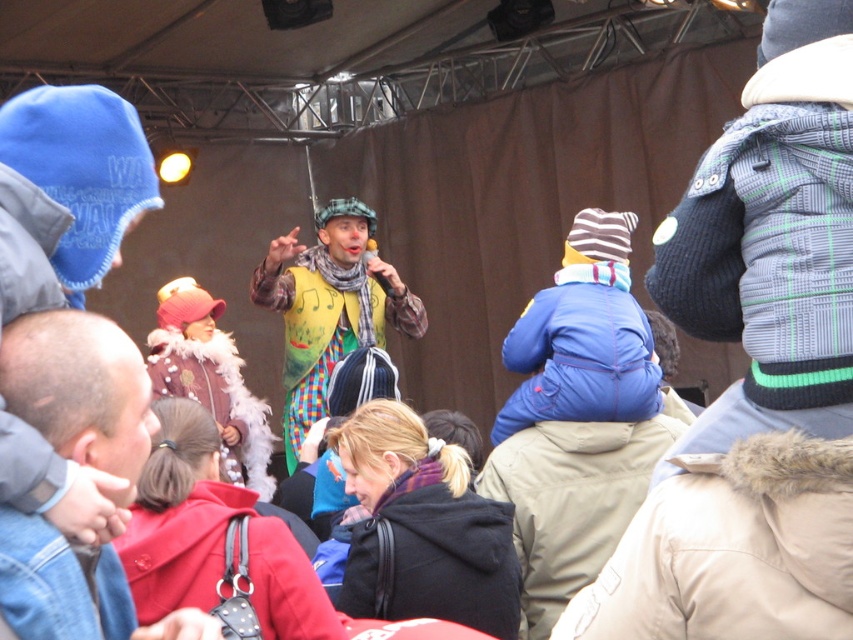
Question: Estimate the real-world distances between objects in this image. Which object is farther from the denim jacket at lower left?

Choices:
 (A) velvet fur coat at center
 (B) black fleece jacket at lower center

Answer: (A)

Question: Does yellow fabric clown at center appear on the right side of velvet fur coat at center?

Choices:
 (A) yes
 (B) no

Answer: (A)

Question: Which object is closer to the camera taking this photo?

Choices:
 (A) yellow fabric clown at center
 (B) black fleece jacket at lower center

Answer: (B)

Question: Which object is positioned farthest from the denim jacket at lower left?

Choices:
 (A) velvet fur coat at center
 (B) yellow fabric clown at center

Answer: (B)

Question: Where is black fleece jacket at lower center located in relation to denim jacket at lower left in the image?

Choices:
 (A) below
 (B) above

Answer: (A)

Question: Can you confirm if black fleece jacket at lower center is smaller than denim jacket at lower left?

Choices:
 (A) no
 (B) yes

Answer: (B)